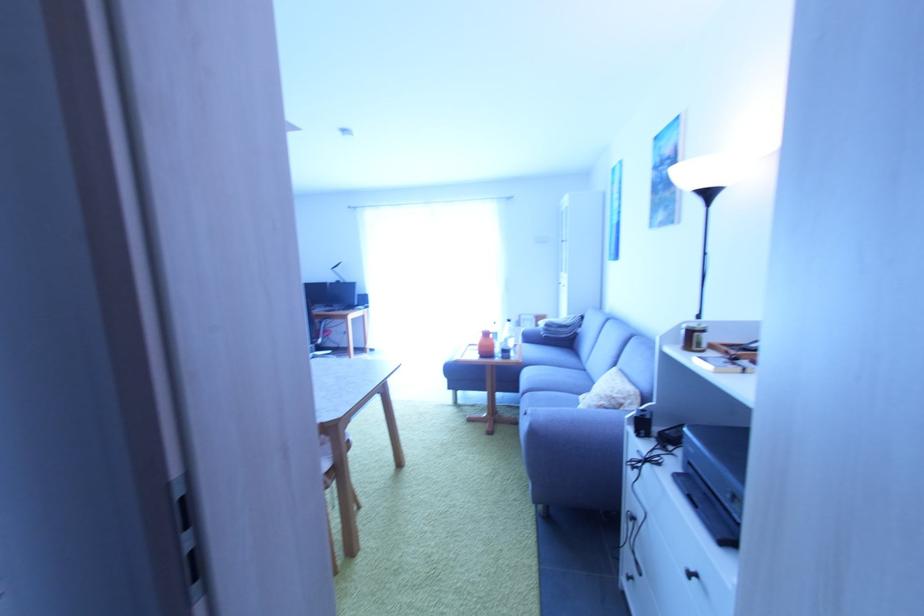
Find where to grasp the clear water bottle. Please return your answer as a coordinate pair (x, y).

(505, 346)